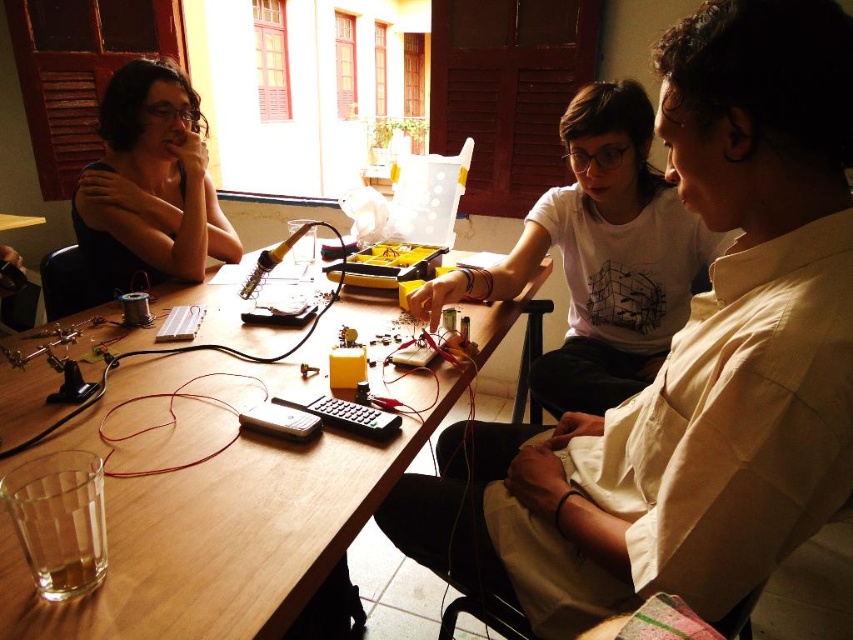
Question: Among these objects, which one is nearest to the camera?

Choices:
 (A) white matte shirt at upper center
 (B) matte black shirt at left
 (C) wooden table at center
 (D) white cotton shirt at center

Answer: (C)

Question: Does wooden table at center appear on the left side of matte black shirt at left?

Choices:
 (A) yes
 (B) no

Answer: (B)

Question: Among these points, which one is nearest to the camera?

Choices:
 (A) (598, 132)
 (B) (529, 465)
 (C) (0, 532)

Answer: (C)

Question: Can you confirm if white matte shirt at upper center is positioned above wooden table at center?

Choices:
 (A) no
 (B) yes

Answer: (A)

Question: Is white matte shirt at upper center positioned in front of matte black shirt at left?

Choices:
 (A) no
 (B) yes

Answer: (B)

Question: Which point is closer to the camera?

Choices:
 (A) (828, 436)
 (B) (585, 381)
 (C) (138, 161)

Answer: (A)